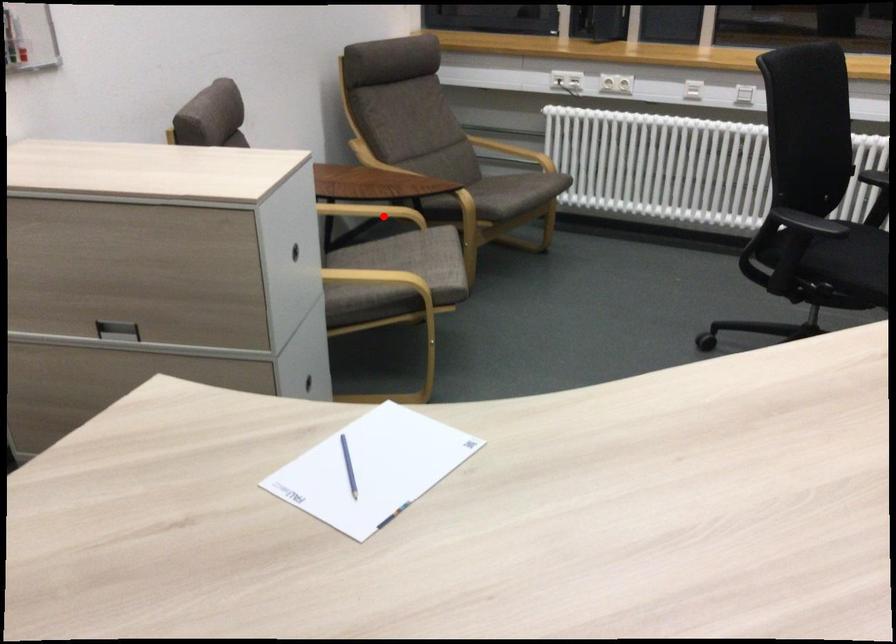
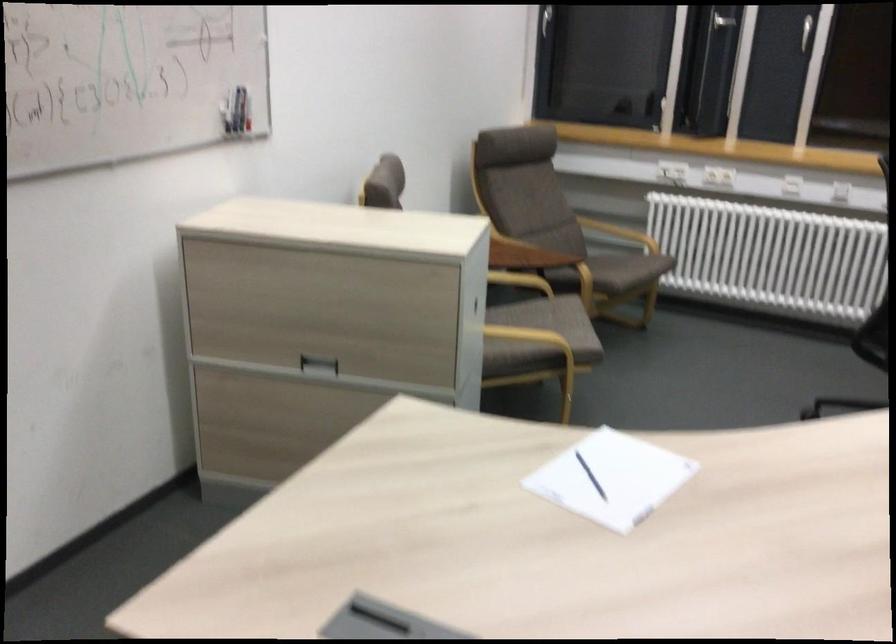
In the second image, find the point that corresponds to the highlighted location in the first image.

(520, 279)